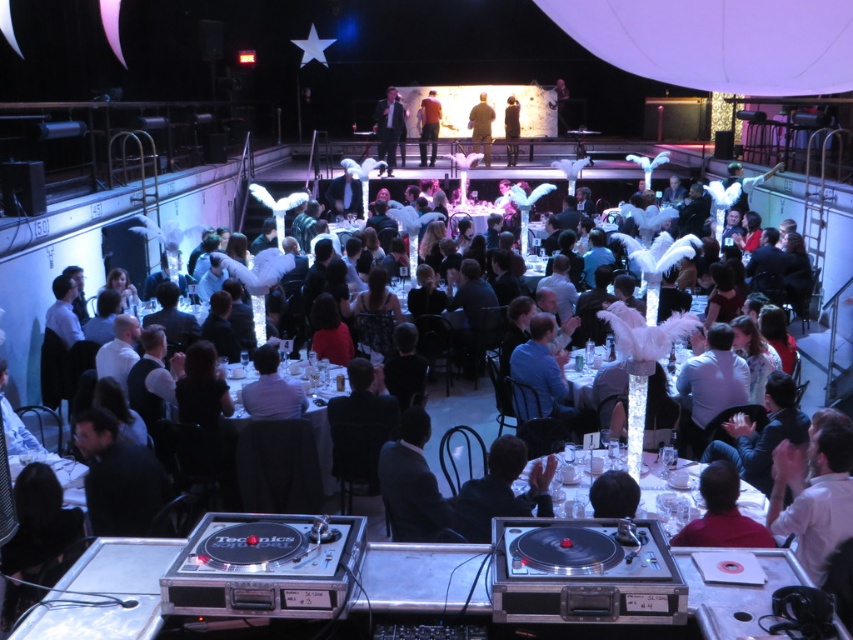
Question: Does black matte hair at center appear on the left side of khaki fabric jacket at center?

Choices:
 (A) no
 (B) yes

Answer: (A)

Question: Among these objects, which one is nearest to the camera?

Choices:
 (A) white feathered centerpiece at center
 (B) white glossy table at center
 (C) dark red shirt at lower right

Answer: (B)

Question: Can you confirm if white glossy shirt at lower right is wider than white glossy shirt at center?

Choices:
 (A) no
 (B) yes

Answer: (B)

Question: Which is nearer to the matte black suit at upper center?

Choices:
 (A) khaki fabric jacket at center
 (B) white glossy table at center
 (C) dark red shirt at lower right
 (D) white glossy shirt at lower right

Answer: (A)

Question: Which point is closer to the camera?

Choices:
 (A) white glossy shirt at center
 (B) khaki fabric jacket at center
 (C) white feathered centerpiece at center
 (D) black leather jacket at center

Answer: (D)

Question: In this image, where is dark red shirt at lower right located relative to matte black suit at upper center?

Choices:
 (A) above
 (B) below

Answer: (B)